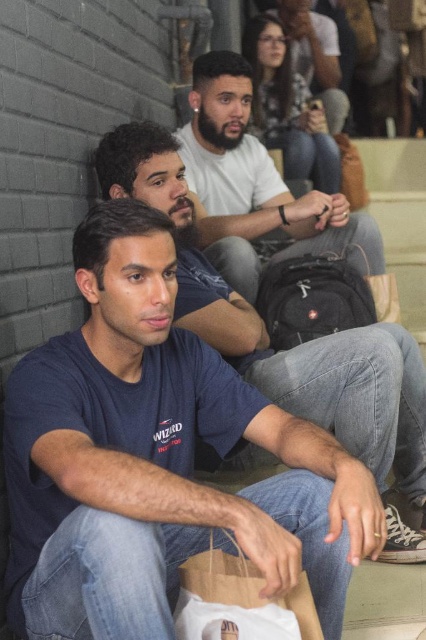
Looking at this image, you are standing in the scene and want to reach the brown paper bag at lower center. Which direction should you move relative to the man in the navy blue T shirt?

The brown paper bag at lower center is located at point (238,602), which is to the right and slightly forward of the man in the navy blue T shirt. You should move towards his right side to reach it.